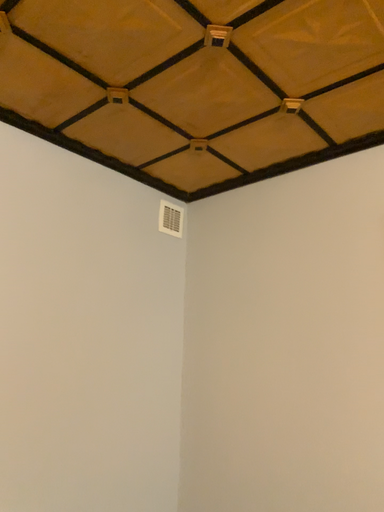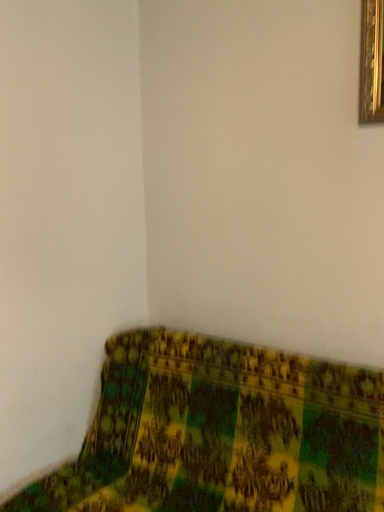
Question: Which way did the camera rotate in the video?

Choices:
 (A) rotated right
 (B) rotated left

Answer: (A)